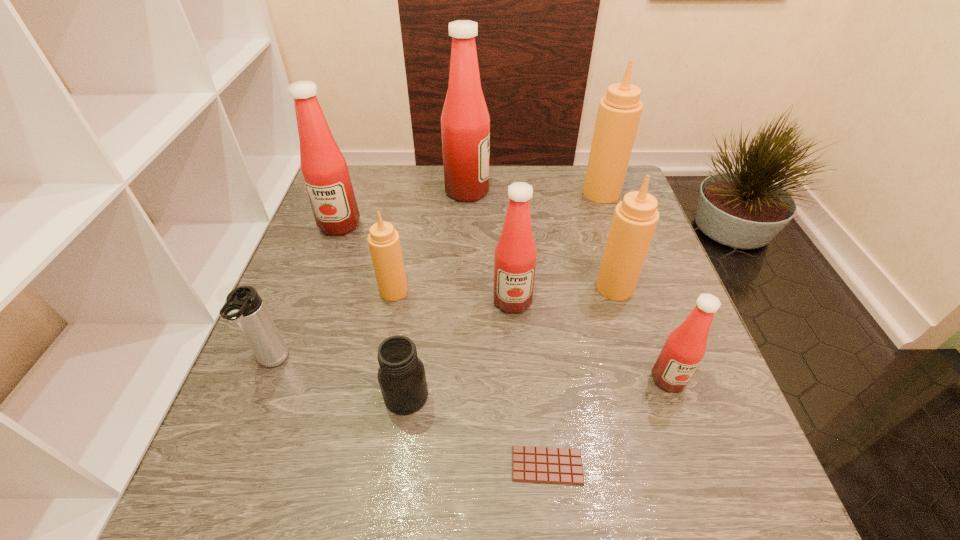
Locate an element on the screen. Image resolution: width=960 pixels, height=540 pixels. vacant space at the far edge is located at coordinates (404, 211).

I want to click on vacant space at the near edge of the desktop, so click(474, 470).

You are a GUI agent. You are given a task and a screenshot of the screen. Output one action in this format:
    pyautogui.click(x=<x>, y=<y>)
    Task: Click on the vacant point at the left edge
    The width and height of the screenshot is (960, 540).
    Given the screenshot: What is the action you would take?
    pyautogui.click(x=300, y=448)

In the image, there is a desktop. In order to click on vacant space at the right edge in this screenshot , I will do `click(655, 428)`.

Where is `vacant area at the far left corner of the desktop`? Image resolution: width=960 pixels, height=540 pixels. vacant area at the far left corner of the desktop is located at coordinates [x=362, y=201].

Locate an element on the screen. free space at the near left corner of the desktop is located at coordinates (197, 507).

You are a GUI agent. You are given a task and a screenshot of the screen. Output one action in this format:
    pyautogui.click(x=<x>, y=<y>)
    Task: Click on the free space between the third biggest red condiment and the third red condiment from right to left
    
    Given the screenshot: What is the action you would take?
    click(x=490, y=246)

You are a GUI agent. You are given a task and a screenshot of the screen. Output one action in this format:
    pyautogui.click(x=<x>, y=<y>)
    Task: Click on the free space that is in between the second shortest object and the farthest red condiment
    Image resolution: width=960 pixels, height=540 pixels.
    Given the screenshot: What is the action you would take?
    pyautogui.click(x=437, y=293)

Where is `blank region between the thermos bottle and the smallest red condiment`? The height and width of the screenshot is (540, 960). blank region between the thermos bottle and the smallest red condiment is located at coordinates (470, 371).

This screenshot has width=960, height=540. I want to click on vacant space that's between the third farthest object and the thermos bottle, so click(x=306, y=294).